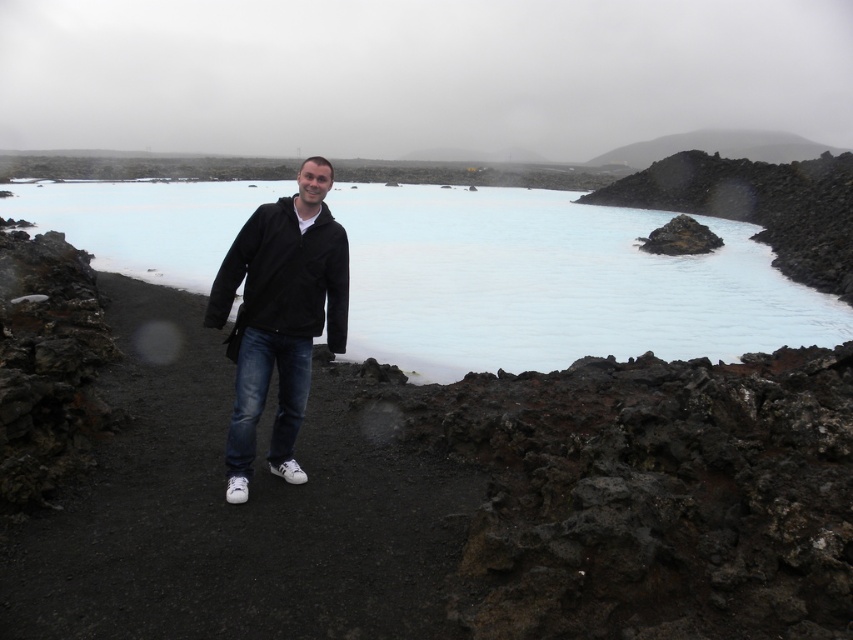
Does blue smooth water at center have a greater height compared to black matte jacket at center?

Yes, blue smooth water at center is taller than black matte jacket at center.

Image resolution: width=853 pixels, height=640 pixels. Find the location of `blue smooth water at center`. blue smooth water at center is located at coordinates 554,284.

Between point (212, 209) and point (338, 330), which one is positioned behind?

The point (212, 209) is behind.

This screenshot has width=853, height=640. What are the coordinates of `blue smooth water at center` in the screenshot? It's located at (554, 284).